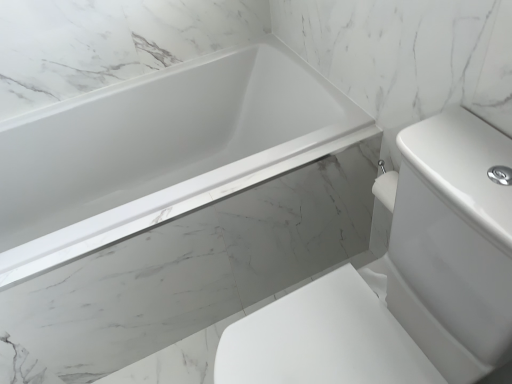
Question: From the image's perspective, is white glossy sink at center above or below white glossy bathtub at upper left?

Choices:
 (A) below
 (B) above

Answer: (A)

Question: In terms of size, does white glossy sink at center appear bigger or smaller than white glossy bathtub at upper left?

Choices:
 (A) small
 (B) big

Answer: (A)

Question: Is white glossy sink at center wider or thinner than white glossy bathtub at upper left?

Choices:
 (A) thin
 (B) wide

Answer: (B)

Question: Considering the positions of point (175, 117) and point (500, 294), is point (175, 117) closer or farther from the camera than point (500, 294)?

Choices:
 (A) farther
 (B) closer

Answer: (A)

Question: Considering the positions of white glossy bathtub at upper left and white glossy sink at center in the image, is white glossy bathtub at upper left bigger or smaller than white glossy sink at center?

Choices:
 (A) big
 (B) small

Answer: (A)

Question: From the image's perspective, is white glossy bathtub at upper left above or below white glossy sink at center?

Choices:
 (A) above
 (B) below

Answer: (A)

Question: From a real-world perspective, relative to white glossy sink at center, is white glossy bathtub at upper left vertically above or below?

Choices:
 (A) below
 (B) above

Answer: (A)